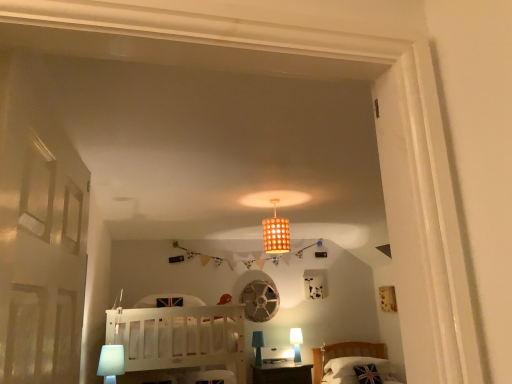
Question: Is wooden lampshade at center positioned in front of union jack fabric pillow at lower right?

Choices:
 (A) yes
 (B) no

Answer: (A)

Question: Is union jack fabric pillow at lower right located within wooden lampshade at center?

Choices:
 (A) yes
 (B) no

Answer: (B)

Question: From a real-world perspective, does wooden lampshade at center sit lower than union jack fabric pillow at lower right?

Choices:
 (A) no
 (B) yes

Answer: (A)

Question: Are wooden lampshade at center and union jack fabric pillow at lower right beside each other?

Choices:
 (A) yes
 (B) no

Answer: (B)

Question: From a real-world perspective, is wooden lampshade at center on union jack fabric pillow at lower right?

Choices:
 (A) no
 (B) yes

Answer: (B)

Question: Can you confirm if wooden lampshade at center is wider than union jack fabric pillow at lower right?

Choices:
 (A) no
 (B) yes

Answer: (A)

Question: Can you confirm if white glossy table lamp at lower right, which ranks as the 3th table lamp in front-to-back order, is shorter than white plastic table lamp at lower left, the 3th table lamp from the right?

Choices:
 (A) yes
 (B) no

Answer: (B)

Question: From a real-world perspective, is white glossy table lamp at lower right, marked as the 3th table lamp in a top-to-bottom arrangement, under white plastic table lamp at lower left, the 3th table lamp from the right?

Choices:
 (A) yes
 (B) no

Answer: (A)

Question: Is white glossy table lamp at lower right, arranged as the first table lamp when ordered from the bottom, positioned beyond the bounds of white plastic table lamp at lower left, arranged as the third table lamp when ordered from the bottom?

Choices:
 (A) no
 (B) yes

Answer: (B)

Question: Is white glossy table lamp at lower right, arranged as the first table lamp when ordered from the bottom, positioned far away from white plastic table lamp at lower left, arranged as the third table lamp when viewed from the back?

Choices:
 (A) yes
 (B) no

Answer: (A)

Question: Can you confirm if white glossy table lamp at lower right, marked as the 3th table lamp in a top-to-bottom arrangement, is taller than white plastic table lamp at lower left, arranged as the third table lamp when ordered from the bottom?

Choices:
 (A) yes
 (B) no

Answer: (A)

Question: Can white plastic table lamp at lower left, arranged as the third table lamp when ordered from the bottom, be found inside white glossy table lamp at lower right, placed as the 1th table lamp when sorted from right to left?

Choices:
 (A) yes
 (B) no

Answer: (B)

Question: Considering the relative sizes of union jack fabric pillow at lower right and white plastic table lamp at lower left, which appears as the 1th table lamp when viewed from the top, in the image provided, is union jack fabric pillow at lower right taller than white plastic table lamp at lower left, which appears as the 1th table lamp when viewed from the top,?

Choices:
 (A) no
 (B) yes

Answer: (A)